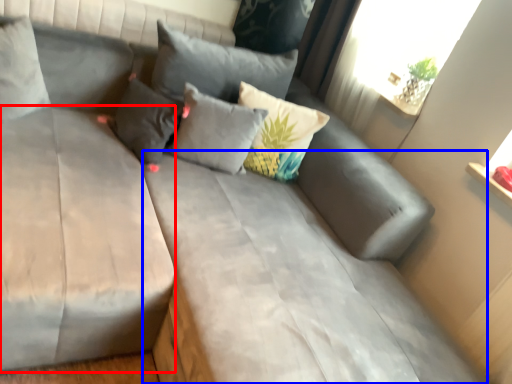
Question: Which point is further to the camera, mattress (highlighted by a red box) or mattress (highlighted by a blue box)?

Choices:
 (A) mattress
 (B) mattress

Answer: (A)